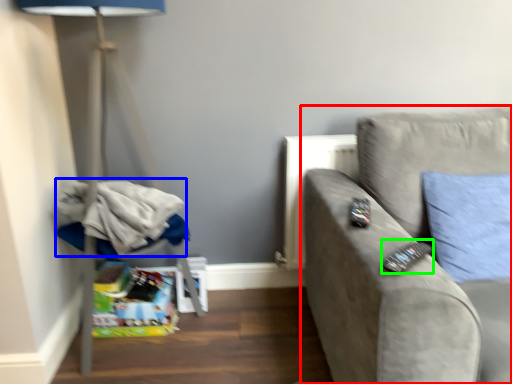
Question: Based on their relative distances, which object is nearer to studio couch (highlighted by a red box)? Choose from laundry (highlighted by a blue box) and remote (highlighted by a green box).

Choices:
 (A) laundry
 (B) remote

Answer: (B)